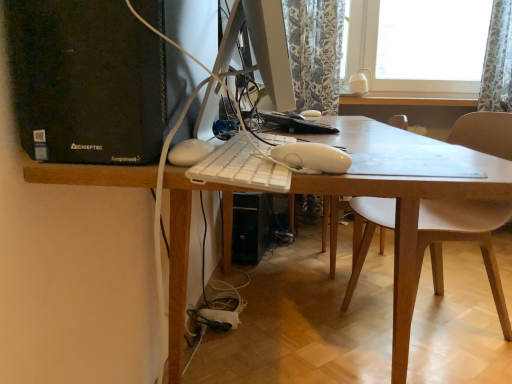
Question: Would you say floral fabric curtain at upper right is to the left or to the right of white plastic keyboard at center in the picture?

Choices:
 (A) left
 (B) right

Answer: (B)

Question: Does point (510, 23) appear closer or farther from the camera than point (243, 145)?

Choices:
 (A) closer
 (B) farther

Answer: (B)

Question: Estimate the real-world distances between objects in this image. Which object is closer to the floral fabric curtain at upper right?

Choices:
 (A) white plastic desk at center
 (B) black plastic computer tower at left
 (C) white plastic keyboard at center

Answer: (A)

Question: Which object is the farthest from the white plastic desk at center?

Choices:
 (A) white plastic keyboard at center
 (B) black plastic computer tower at left
 (C) floral fabric curtain at upper right

Answer: (C)